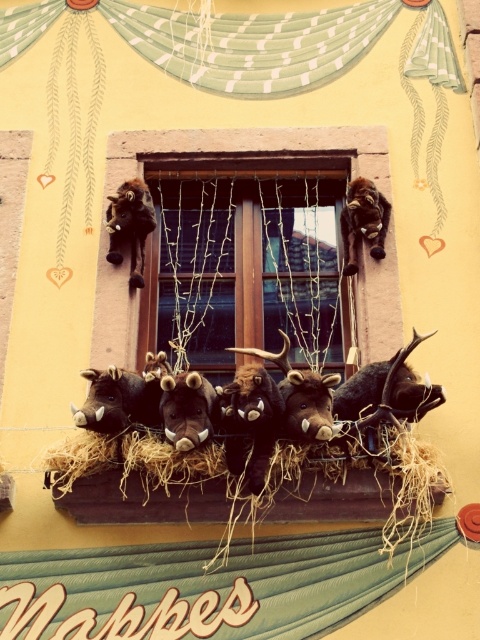
Question: Where is brown plush goat at upper left located in relation to brown plush toy at upper center in the image?

Choices:
 (A) left
 (B) right

Answer: (A)

Question: Which point is closer to the camera taking this photo?

Choices:
 (A) (144, 230)
 (B) (282, 161)

Answer: (A)

Question: Is wooden window at center to the left of brown plush goat at upper left from the viewer's perspective?

Choices:
 (A) no
 (B) yes

Answer: (A)

Question: Does wooden window at center have a larger size compared to brown plush goat at upper left?

Choices:
 (A) yes
 (B) no

Answer: (A)

Question: Considering the real-world distances, which object is closest to the brown plush toy at upper center?

Choices:
 (A) brown plush goat at upper left
 (B) wooden window at center

Answer: (B)

Question: Which object appears farthest from the camera in this image?

Choices:
 (A) wooden window at center
 (B) brown plush toy at upper center
 (C) brown plush goat at upper left

Answer: (B)